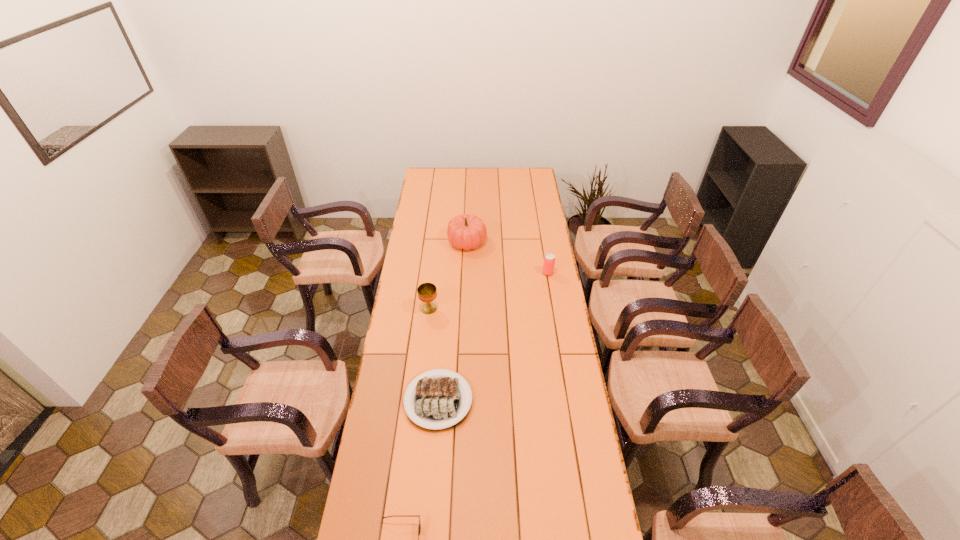
Image resolution: width=960 pixels, height=540 pixels. What are the coordinates of `vacant area that lies between the plate and the chalice` in the screenshot? It's located at (434, 354).

This screenshot has height=540, width=960. Identify the location of the third closest object to the sunglasses. pyautogui.click(x=549, y=260).

The height and width of the screenshot is (540, 960). In order to click on the fourth closest object to the chalice in this screenshot , I will do `click(419, 527)`.

Find the location of `free space in the image that satisfies the following two spatial constraints: 1. on the back side of the farthest object; 2. on the right side of the plate`. free space in the image that satisfies the following two spatial constraints: 1. on the back side of the farthest object; 2. on the right side of the plate is located at coordinates (450, 241).

Image resolution: width=960 pixels, height=540 pixels. Identify the location of vacant area that satisfies the following two spatial constraints: 1. on the back side of the pumpkin; 2. on the left side of the plate. (450, 241).